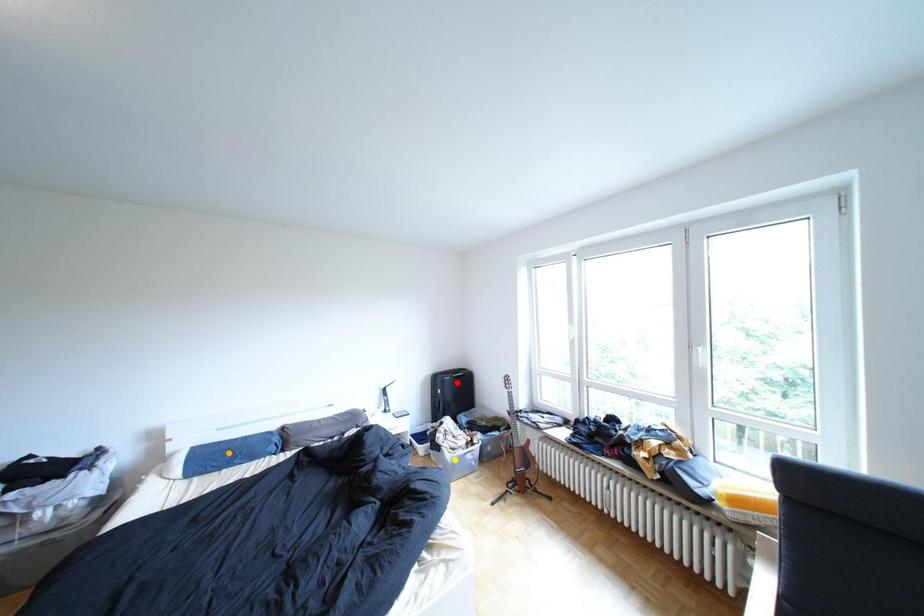
Order these from farthest to nearest:
yellow point | orange point | red point

red point < yellow point < orange point